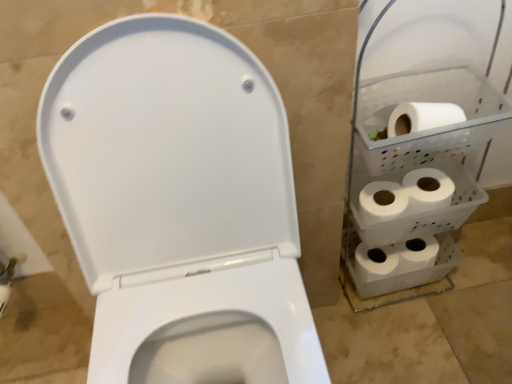
At what (x,y) coordinates should I click in order to perform the action: click on free space to the right of white matte toilet paper at lower right, which is the 3th toilet paper from right to left. Please return your answer as a coordinate pair (x, y). The image size is (512, 384). Looking at the image, I should click on (450, 302).